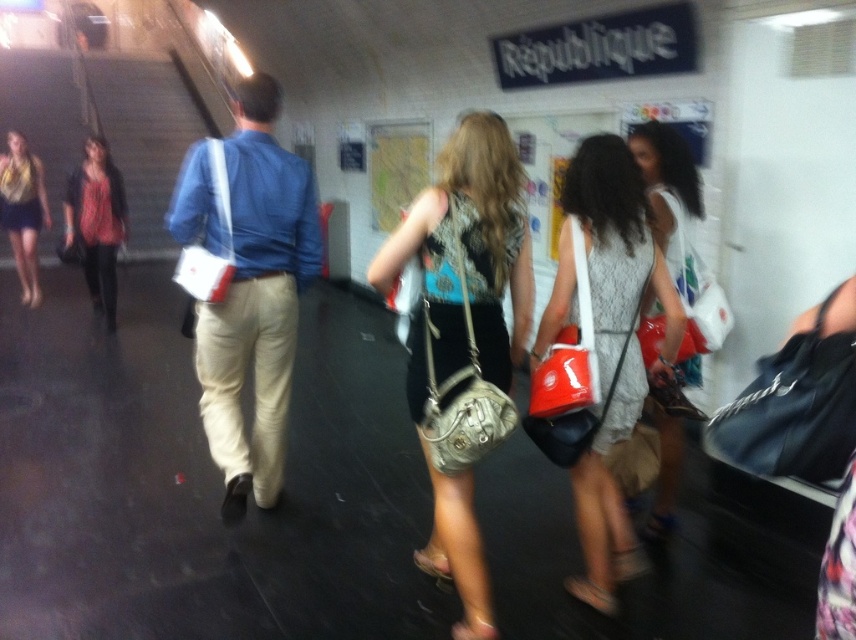
Question: Estimate the real-world distances between objects in this image. Which object is farther from the matte black jacket at left?

Choices:
 (A) leather-like beige purse at center
 (B) black fabric bag at lower right
 (C) leather purse at center

Answer: (B)

Question: Is leather purse at center thinner than metallic silver escalator at left?

Choices:
 (A) no
 (B) yes

Answer: (B)

Question: Is leather purse at center smaller than matte gray dress at center?

Choices:
 (A) yes
 (B) no

Answer: (B)

Question: Which point is closer to the camera?

Choices:
 (A) (421, 336)
 (B) (72, 234)
 (C) (562, 444)

Answer: (A)

Question: Can you confirm if white fabric dress at center is thinner than matte black jacket at left?

Choices:
 (A) yes
 (B) no

Answer: (A)

Question: Which object is farther from the camera taking this photo?

Choices:
 (A) metallic silver escalator at left
 (B) blue denim shirt at center
 (C) white fabric dress at center
 (D) matte gray dress at center

Answer: (A)